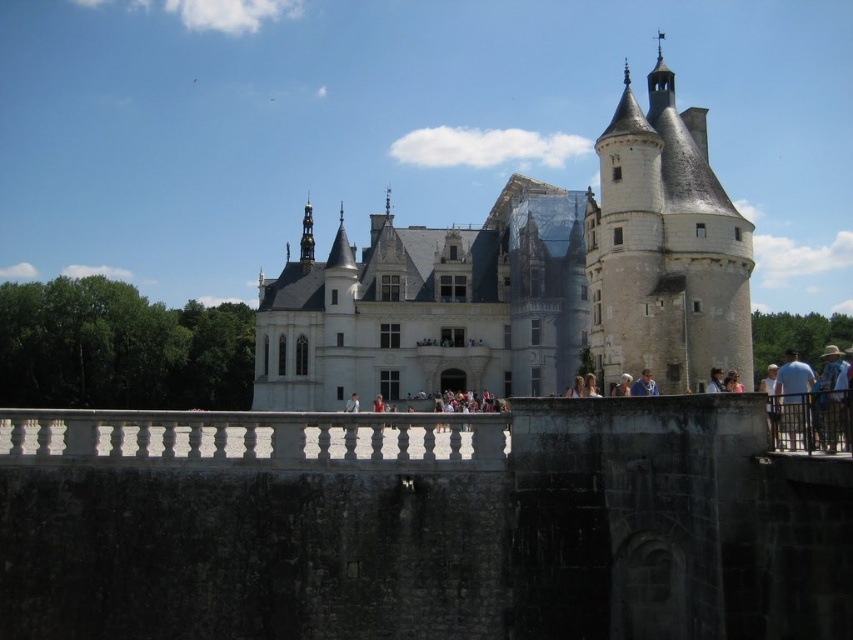
Looking at this image, you are a tourist standing on the bridge leading to the castle. You notice the white stone railing at center and the white fabric hat at upper center. Which object is bigger?

The white stone railing at center is larger in size compared to the white fabric hat at upper center.

You are a tourist standing on the bridge in front of the castle. You notice two objects in the scene. The first is the white stone tower at upper right, and the second is the white cotton shirt at upper center. Which object is narrower in width?

The white stone tower at upper right is narrower in width than the white cotton shirt at upper center.

From the picture: You are an artist standing on a bridge near the castle, and you want to paint the scene. You notice the brown fabric hat at upper right and the white cotton shirt at upper center. Which object is located above the other?

The brown fabric hat at upper right is positioned over the white cotton shirt at upper center, so it is above the other.